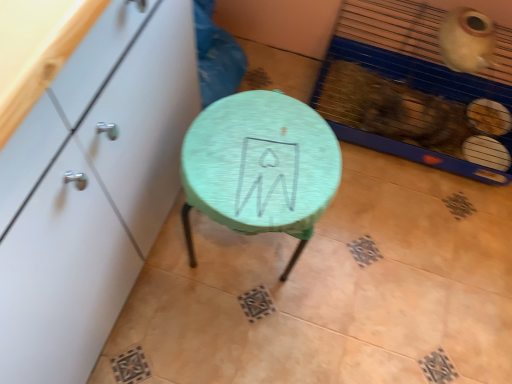
Locate an element on the screen. This screenshot has height=384, width=512. vacant area on top of mint green fabric stool at center (from a real-world perspective) is located at coordinates (265, 150).